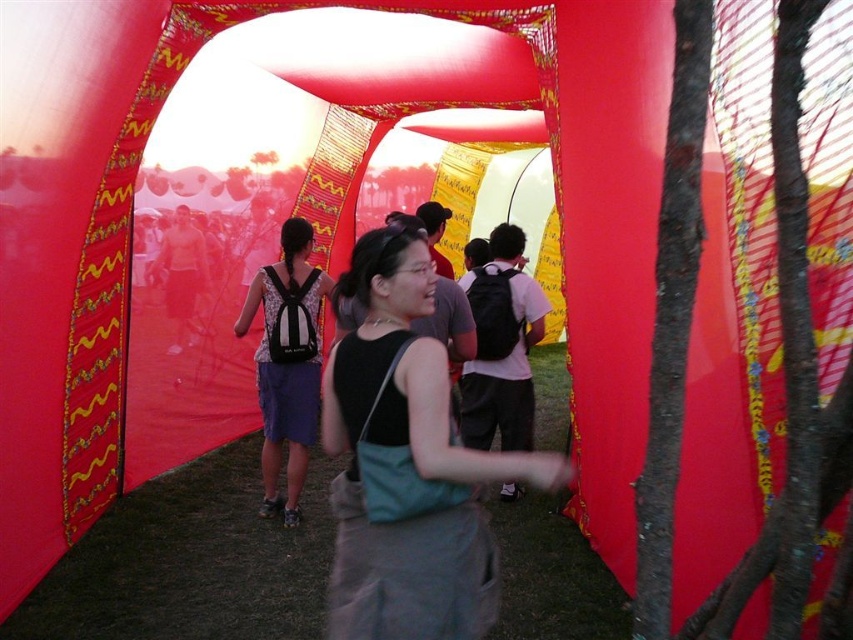
Question: Which point is closer to the camera taking this photo?

Choices:
 (A) (306, 369)
 (B) (473, 476)

Answer: (B)

Question: Is black fabric bag at center smaller than matte black backpack at center?

Choices:
 (A) no
 (B) yes

Answer: (B)

Question: Which point appears farthest from the camera in this image?

Choices:
 (A) (318, 362)
 (B) (384, 273)

Answer: (A)

Question: Can you confirm if black fabric bag at center is positioned below matte black backpack at center?

Choices:
 (A) yes
 (B) no

Answer: (A)

Question: Among these points, which one is nearest to the camera?

Choices:
 (A) (337, 436)
 (B) (293, 278)

Answer: (A)

Question: Can you confirm if black fabric bag at center is thinner than matte black backpack at center?

Choices:
 (A) yes
 (B) no

Answer: (B)